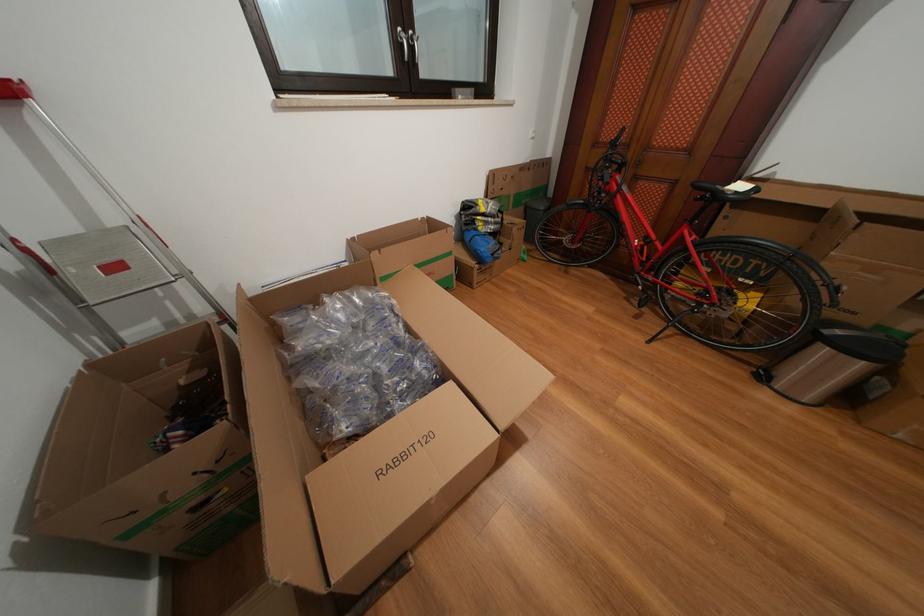
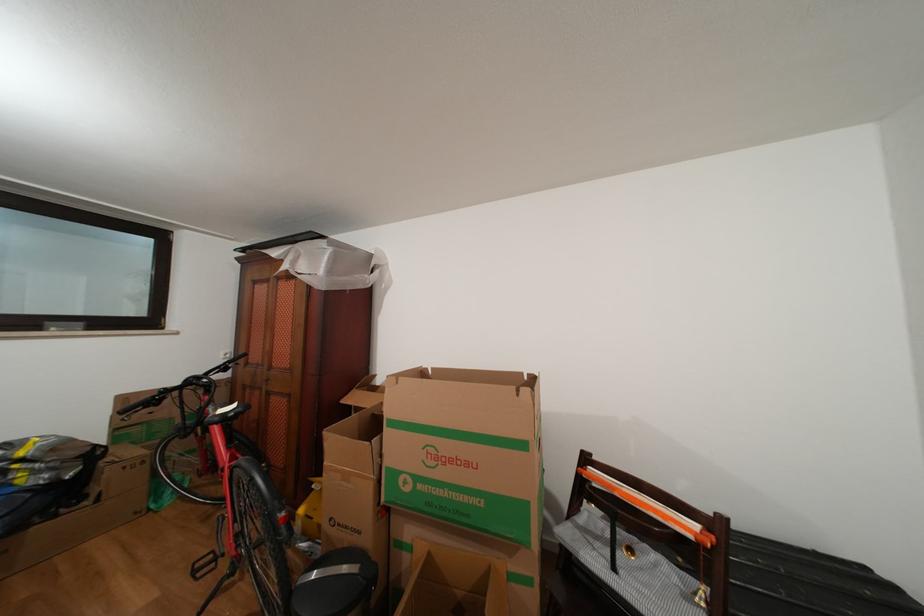
In the second image, find the point that corresponds to pixel 633 193 in the first image.

(219, 414)